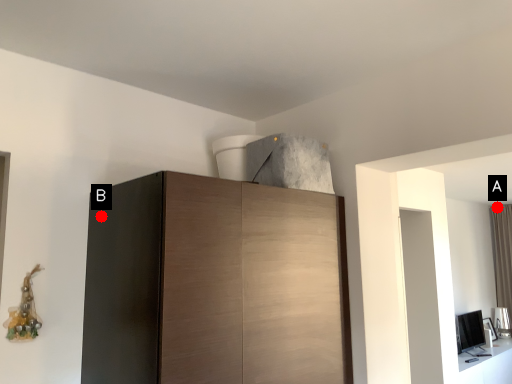
Question: Two points are circled on the image, labeled by A and B beside each circle. Which point is closer to the camera?

Choices:
 (A) A is closer
 (B) B is closer

Answer: (B)